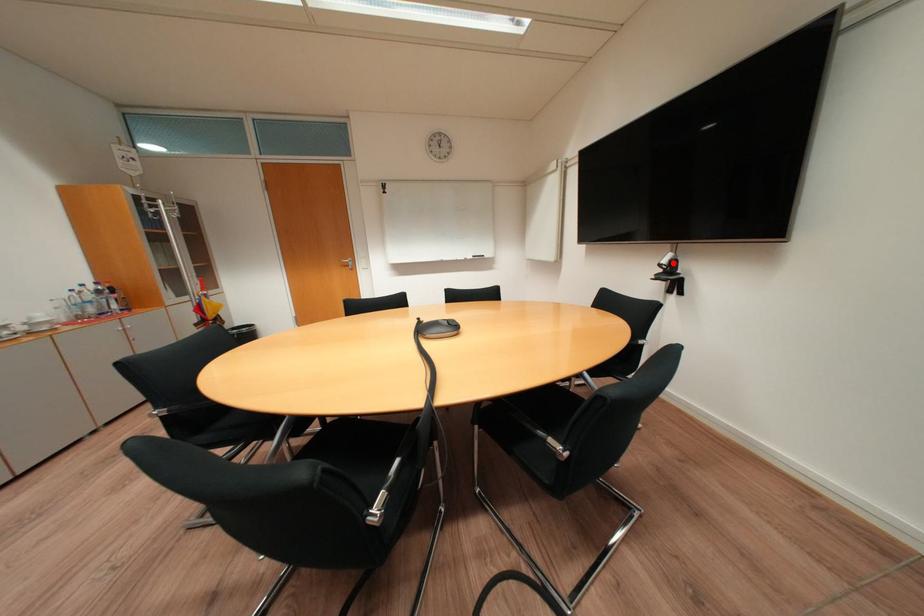
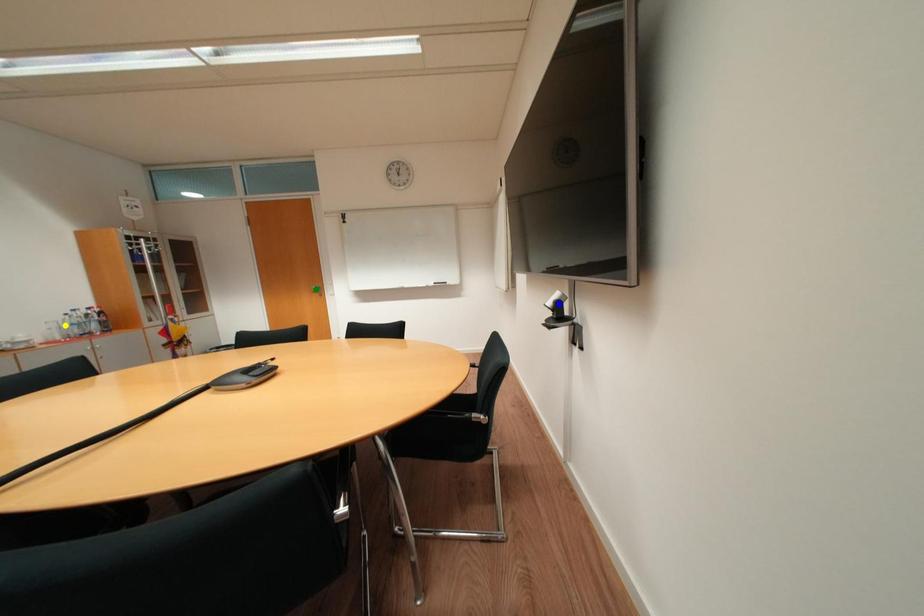
Question: I am providing you with two images of the same scene from different viewpoints. A red point is marked on the first image. You are given multiple points on the second image. Can you choose the point in image 2 that corresponds to the point in image 1?

Choices:
 (A) blue point
 (B) yellow point
 (C) green point

Answer: (A)